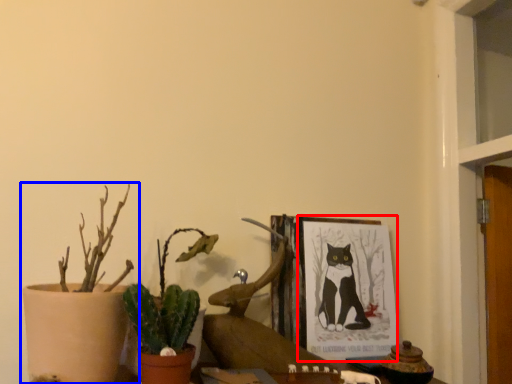
Question: Which object is closer to the camera taking this photo, picture frame (highlighted by a red box) or houseplant (highlighted by a blue box)?

Choices:
 (A) picture frame
 (B) houseplant

Answer: (B)